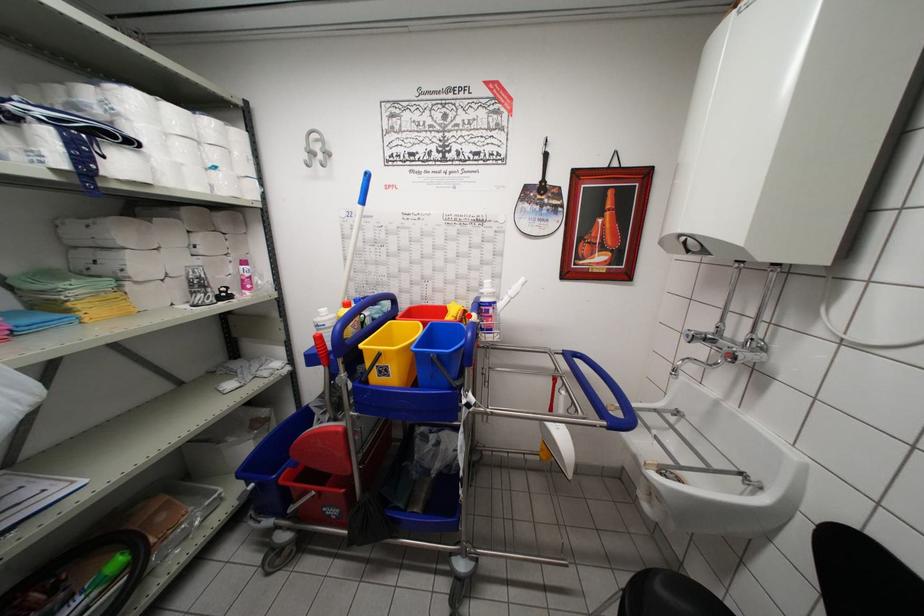
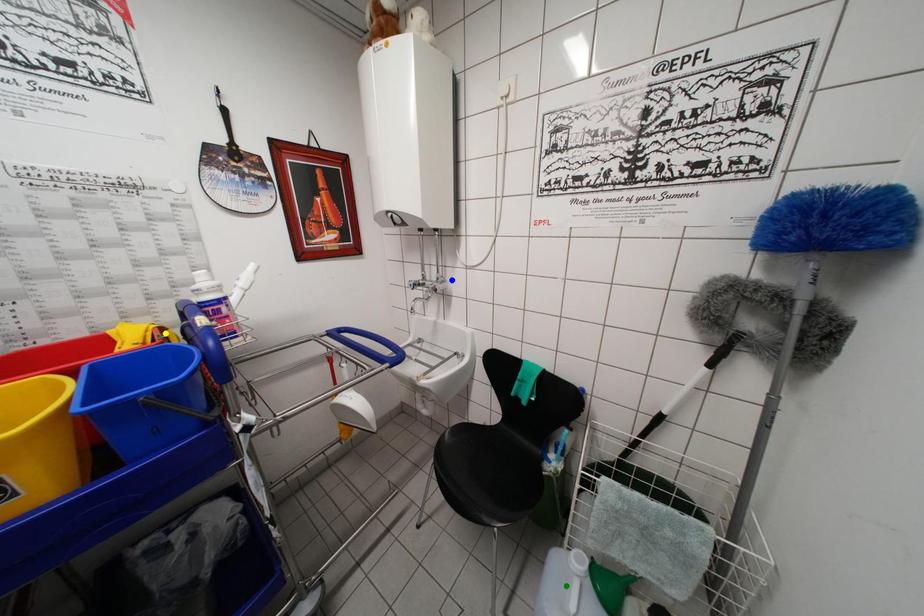
Question: I am providing you with two images of the same scene from different viewpoints. A red point is marked on the first image. You are given multiple points on the second image. In image 2, which mark is for the same physical point as the one in image 1?

Choices:
 (A) green point
 (B) yellow point
 (C) blue point

Answer: (B)